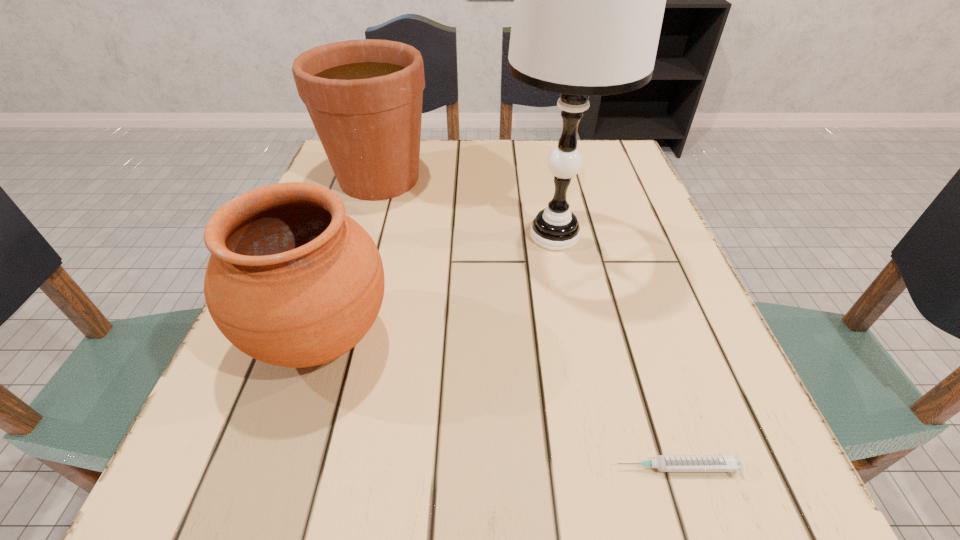
Locate an element on the screen. free space that is in between the pottery and the tallest object is located at coordinates (438, 287).

Identify the location of empty space between the shortest object and the table lamp. (615, 352).

Identify the location of vacant area that lies between the pottery and the shortest object. This screenshot has width=960, height=540. (499, 403).

Where is `the second closest object to the second nearest object`? the second closest object to the second nearest object is located at coordinates [364, 97].

This screenshot has width=960, height=540. I want to click on object that is the third closest to the third farthest object, so click(732, 463).

What are the coordinates of `blank space that satisfies the following two spatial constraints: 1. on the front side of the table lamp; 2. on the left side of the flowerpot` in the screenshot? It's located at (362, 235).